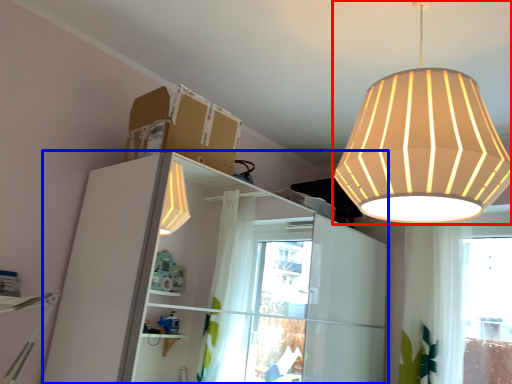
Question: Which object is closer to the camera taking this photo, lamp (highlighted by a red box) or dresser (highlighted by a blue box)?

Choices:
 (A) lamp
 (B) dresser

Answer: (A)